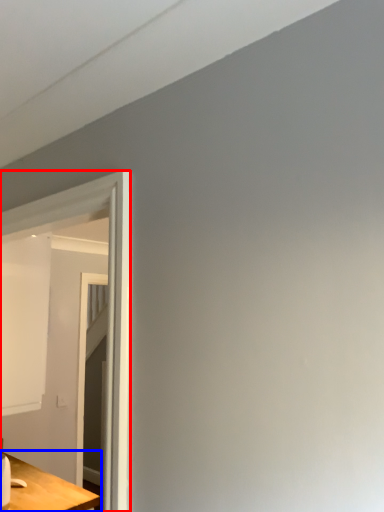
Question: Among these objects, which one is nearest to the camera, glass door (highlighted by a red box) or table (highlighted by a blue box)?

Choices:
 (A) glass door
 (B) table

Answer: (A)